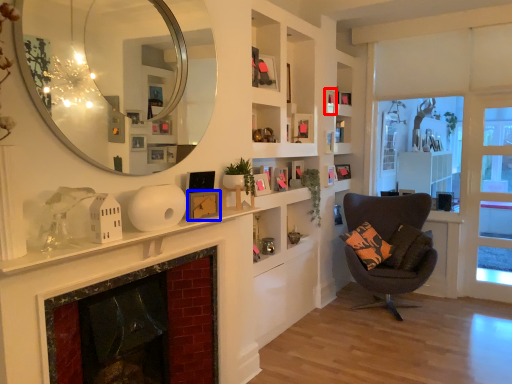
Question: Among these objects, which one is nearest to the camera, picture frame (highlighted by a red box) or picture frame (highlighted by a blue box)?

Choices:
 (A) picture frame
 (B) picture frame

Answer: (B)